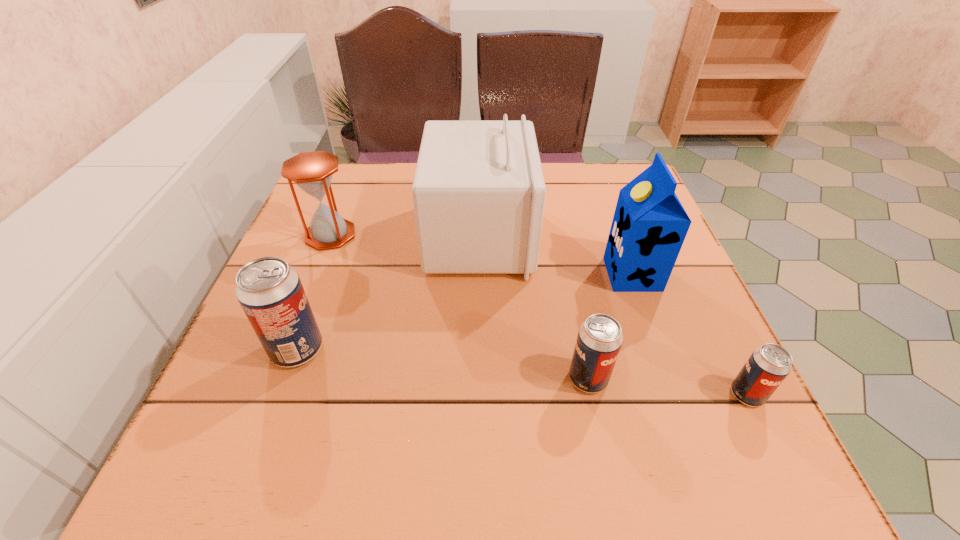
Locate an element on the screen. the tallest beer can is located at coordinates (270, 292).

Locate an element on the screen. the fourth object from left to right is located at coordinates (599, 340).

Where is `the second shortest beer can`? the second shortest beer can is located at coordinates (599, 340).

What are the coordinates of `the shortest beer can` in the screenshot? It's located at (767, 367).

Identify the location of the rightmost object. The height and width of the screenshot is (540, 960). (767, 367).

You are a GUI agent. You are given a task and a screenshot of the screen. Output one action in this format:
    pyautogui.click(x=<x>, y=<y>)
    Task: Click on the carton
    
    Given the screenshot: What is the action you would take?
    pyautogui.click(x=649, y=226)

You are a GUI agent. You are given a task and a screenshot of the screen. Output one action in this format:
    pyautogui.click(x=<x>, y=<y>)
    Task: Click on the third object from left to right
    The width and height of the screenshot is (960, 540).
    Given the screenshot: What is the action you would take?
    pyautogui.click(x=478, y=193)

Image resolution: width=960 pixels, height=540 pixels. I want to click on hourglass, so click(x=312, y=171).

Locate an element on the screen. This screenshot has height=540, width=960. vacant space located 0.160m on the right of the leftmost beer can is located at coordinates (411, 349).

Locate an element on the screen. This screenshot has width=960, height=540. vacant region located on the left of the fourth object from left to right is located at coordinates (522, 379).